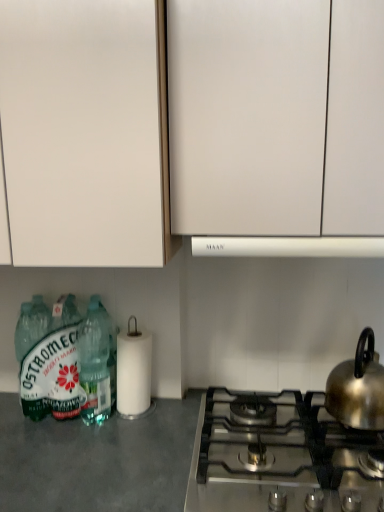
Find the location of a particular element. space that is in front of white matte paper towel at lower center is located at coordinates (129, 441).